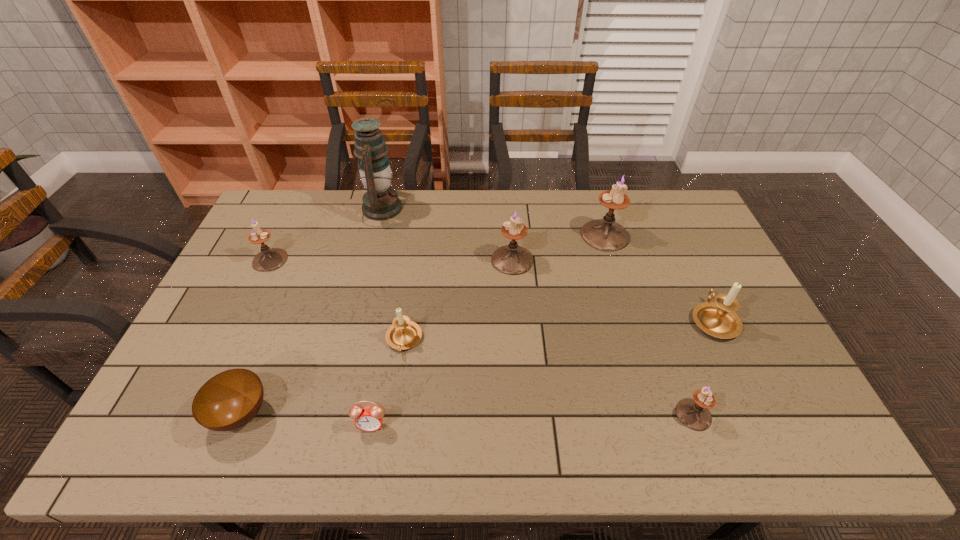
Find the location of `object that is the sixth closest one to the tallest candle holder`. object that is the sixth closest one to the tallest candle holder is located at coordinates (369, 418).

What are the coordinates of `object that is the third closest to the left beige candle holder` in the screenshot? It's located at (512, 259).

Where is `candle holder that is the fifth closest one to the nearest candle holder`? The width and height of the screenshot is (960, 540). candle holder that is the fifth closest one to the nearest candle holder is located at coordinates (269, 259).

Choose which candle holder is the second nearest neighbor to the rightmost candle holder. Please provide its 2D coordinates. Your answer should be formatted as a tuple, i.e. [(x, y)], where the tuple contains the x and y coordinates of a point satisfying the conditions above.

[(605, 234)]

Point out which purple candle holder is positioned as the fourth nearest to the left beige candle holder. Please provide its 2D coordinates. Your answer should be formatted as a tuple, i.e. [(x, y)], where the tuple contains the x and y coordinates of a point satisfying the conditions above.

[(693, 413)]

Locate an element on the screen. The width and height of the screenshot is (960, 540). the third closest purple candle holder relative to the bowl is located at coordinates (693, 413).